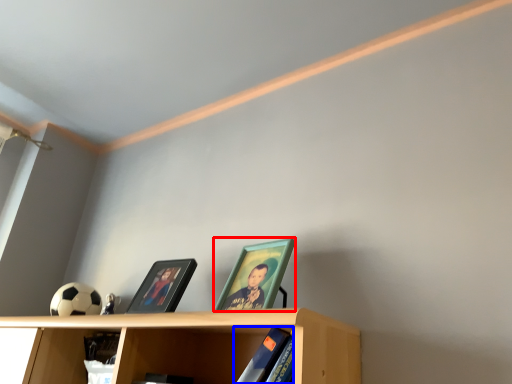
Question: Which object appears closest to the camera in this image, picture frame (highlighted by a red box) or book (highlighted by a blue box)?

Choices:
 (A) picture frame
 (B) book

Answer: (B)